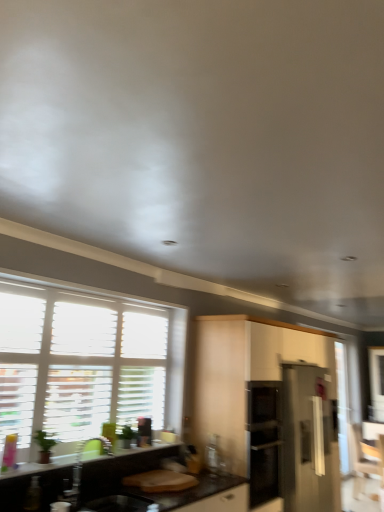
Question: From the image's perspective, is satin white cabinet at center beneath black laminate countertop at lower left?

Choices:
 (A) no
 (B) yes

Answer: (B)

Question: Does satin white cabinet at center have a greater height compared to black laminate countertop at lower left?

Choices:
 (A) yes
 (B) no

Answer: (A)

Question: Considering the relative sizes of satin white cabinet at center and black laminate countertop at lower left in the image provided, is satin white cabinet at center shorter than black laminate countertop at lower left?

Choices:
 (A) no
 (B) yes

Answer: (A)

Question: Can you see satin white cabinet at center touching black laminate countertop at lower left?

Choices:
 (A) yes
 (B) no

Answer: (B)

Question: Is satin white cabinet at center aimed at black laminate countertop at lower left?

Choices:
 (A) no
 (B) yes

Answer: (A)

Question: From a real-world perspective, is black matte sink at lower left positioned above or below stainless steel refrigerator at right?

Choices:
 (A) below
 (B) above

Answer: (B)

Question: From the image's perspective, is black matte sink at lower left located above or below stainless steel refrigerator at right?

Choices:
 (A) above
 (B) below

Answer: (A)

Question: Looking at the image, does black matte sink at lower left seem bigger or smaller compared to stainless steel refrigerator at right?

Choices:
 (A) small
 (B) big

Answer: (A)

Question: Is point (74, 487) positioned closer to the camera than point (334, 474)?

Choices:
 (A) closer
 (B) farther

Answer: (A)

Question: Looking at their shapes, would you say wooden armchair at lower right is wider or thinner than black matte sink at lower left?

Choices:
 (A) wide
 (B) thin

Answer: (A)

Question: In terms of height, does wooden armchair at lower right look taller or shorter compared to black matte sink at lower left?

Choices:
 (A) tall
 (B) short

Answer: (A)

Question: Is point (377, 459) closer or farther from the camera than point (77, 480)?

Choices:
 (A) farther
 (B) closer

Answer: (A)

Question: Based on their positions, is wooden armchair at lower right located to the left or right of black matte sink at lower left?

Choices:
 (A) left
 (B) right

Answer: (B)

Question: Is stainless steel refrigerator at right inside or outside of wooden armchair at lower right?

Choices:
 (A) outside
 (B) inside

Answer: (A)

Question: From a real-world perspective, is stainless steel refrigerator at right above or below wooden armchair at lower right?

Choices:
 (A) below
 (B) above

Answer: (B)